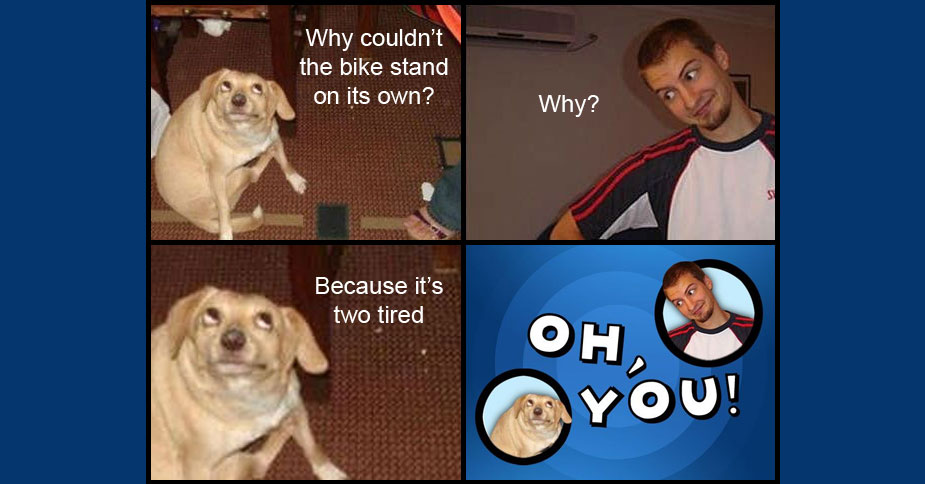
At what (x,y) coordinates should I click in order to perform the action: click on carpet. Please return your answer as a coordinate pair (x, y). This screenshot has width=925, height=484. Looking at the image, I should click on (384, 408), (346, 145).